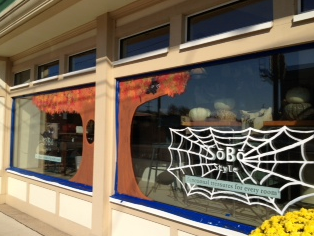
The height and width of the screenshot is (236, 314). I want to click on room, so click(x=271, y=192).